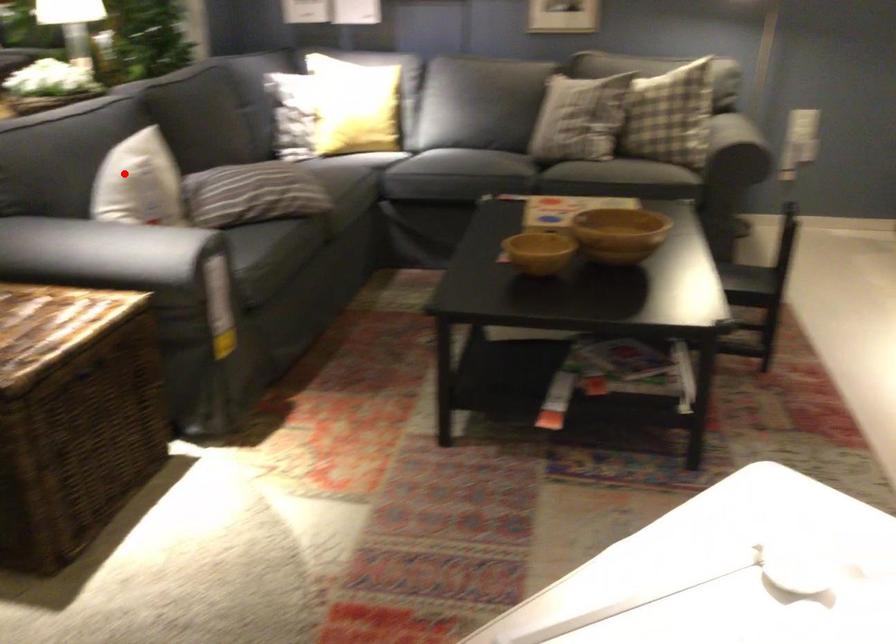
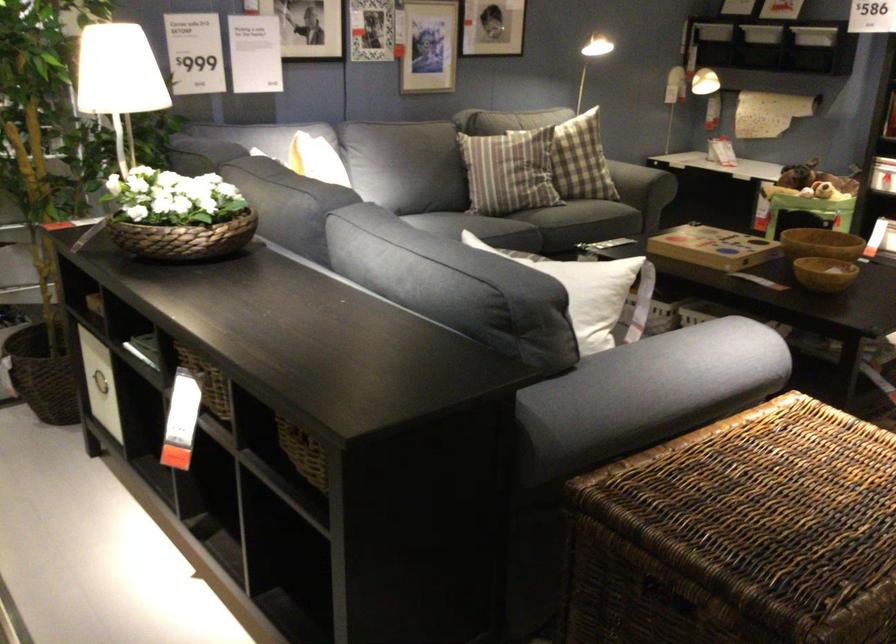
Question: I am providing you with two images of the same scene from different viewpoints. A red point is marked on the first image. Is the red point's position out of view in image 2?

Choices:
 (A) Yes
 (B) No

Answer: (B)